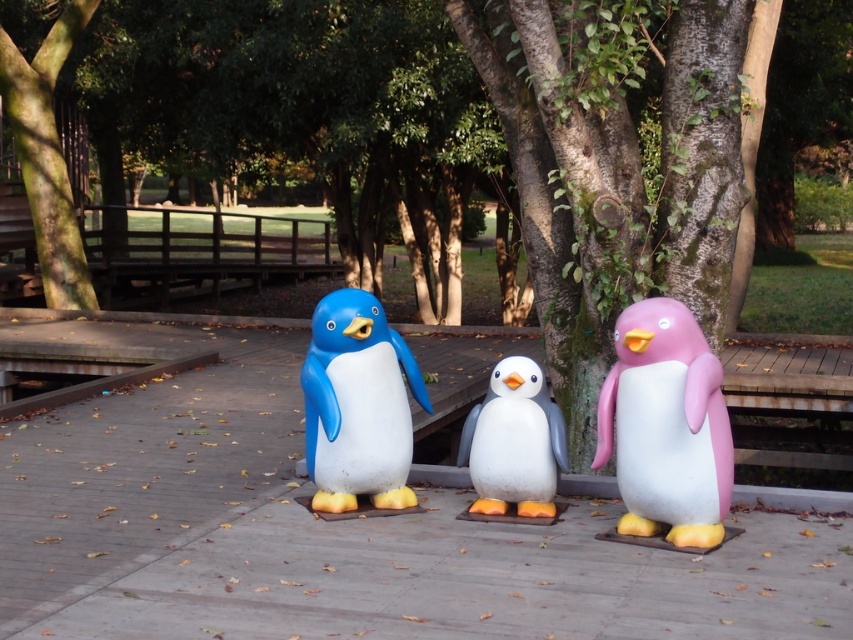
What do you see at coordinates (358, 404) in the screenshot? The width and height of the screenshot is (853, 640). I see `matte blue penguin at center` at bounding box center [358, 404].

Between matte blue penguin at center and white matte penguin at center, which one has less height?

Standing shorter between the two is white matte penguin at center.

The height and width of the screenshot is (640, 853). Describe the element at coordinates (358, 404) in the screenshot. I see `matte blue penguin at center` at that location.

Find the location of a particular element. matte blue penguin at center is located at coordinates (358, 404).

Can you confirm if pink matte/painted penguin at right is shorter than white matte penguin at center?

No.

Is point (639, 337) positioned after point (521, 493)?

No, it is not.

Locate an element on the screen. pink matte/painted penguin at right is located at coordinates (666, 426).

Which is behind, point (704, 513) or point (62, 44)?

Positioned behind is point (62, 44).

Does pink matte/painted penguin at right appear on the right side of green rough bark tree at upper center?

Correct, you'll find pink matte/painted penguin at right to the right of green rough bark tree at upper center.

Is point (646, 372) in front of point (53, 72)?

Yes, it is.

You are a GUI agent. You are given a task and a screenshot of the screen. Output one action in this format:
    pyautogui.click(x=<x>, y=<y>)
    Task: Click on the pink matte/painted penguin at right
    This screenshot has width=853, height=640.
    Given the screenshot: What is the action you would take?
    click(666, 426)